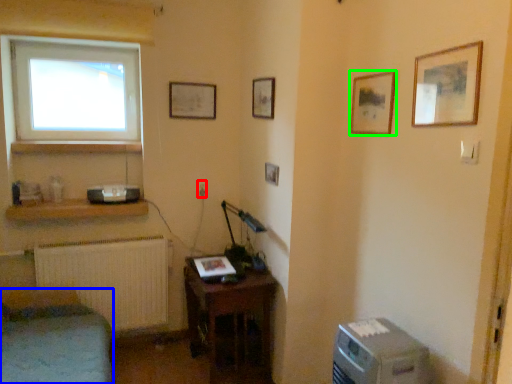
Question: Estimate the real-world distances between objects in this image. Which object is farther from electric outlet (highlighted by a red box), furniture (highlighted by a blue box) or picture frame (highlighted by a green box)?

Choices:
 (A) furniture
 (B) picture frame

Answer: (B)